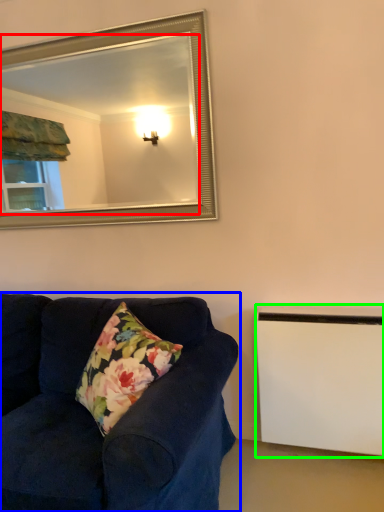
Question: Which object is positioned farthest from mirror (highlighted by a red box)? Select from studio couch (highlighted by a blue box) and radiator (highlighted by a green box).

Choices:
 (A) studio couch
 (B) radiator

Answer: (B)